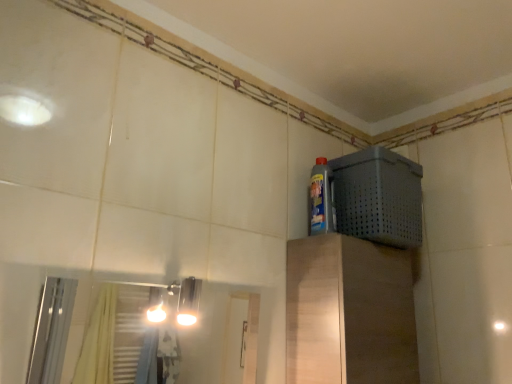
Question: Looking at the image, does blue glossy bottle at upper right seem bigger or smaller compared to gray perforated basket at upper right?

Choices:
 (A) big
 (B) small

Answer: (B)

Question: From the image's perspective, is blue glossy bottle at upper right above or below gray perforated basket at upper right?

Choices:
 (A) below
 (B) above

Answer: (B)

Question: Is blue glossy bottle at upper right wider or thinner than gray perforated basket at upper right?

Choices:
 (A) wide
 (B) thin

Answer: (B)

Question: Considering the positions of gray perforated basket at upper right and blue glossy bottle at upper right in the image, is gray perforated basket at upper right wider or thinner than blue glossy bottle at upper right?

Choices:
 (A) thin
 (B) wide

Answer: (B)

Question: From the image's perspective, relative to blue glossy bottle at upper right, is gray perforated basket at upper right above or below?

Choices:
 (A) below
 (B) above

Answer: (A)

Question: Do you think gray perforated basket at upper right is within blue glossy bottle at upper right, or outside of it?

Choices:
 (A) outside
 (B) inside

Answer: (A)

Question: In terms of height, does gray perforated basket at upper right look taller or shorter compared to blue glossy bottle at upper right?

Choices:
 (A) short
 (B) tall

Answer: (B)